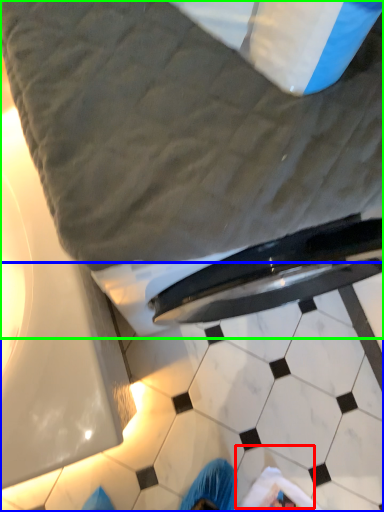
Question: Considering the real-world distances, which object is closest to tile (highlighted by a red box)? tile (highlighted by a blue box) or bed (highlighted by a green box).

Choices:
 (A) tile
 (B) bed

Answer: (A)